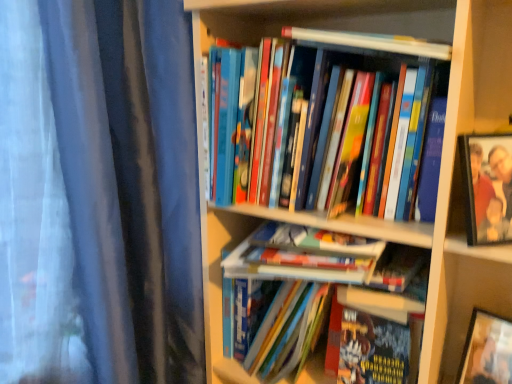
Question: Can you confirm if wooden bookshelf at center is bigger than hardcover books at center, the fourth book positioned from the top?

Choices:
 (A) yes
 (B) no

Answer: (A)

Question: From a real-world perspective, is wooden bookshelf at center on top of hardcover books at center, the fourth book positioned from the top?

Choices:
 (A) no
 (B) yes

Answer: (B)

Question: Would you say wooden bookshelf at center is outside hardcover books at center, the fourth book positioned from the top?

Choices:
 (A) yes
 (B) no

Answer: (A)

Question: Does wooden bookshelf at center have a lesser width compared to hardcover books at center, which ranks as the 3th book in bottom-to-top order?

Choices:
 (A) yes
 (B) no

Answer: (B)

Question: From the image's perspective, is wooden bookshelf at center on hardcover books at center, which ranks as the 3th book in bottom-to-top order?

Choices:
 (A) yes
 (B) no

Answer: (A)

Question: Is hardcover book at center, placed as the fifth book when sorted from top to bottom, wider or thinner than hardcover book at center, the 6th book from the top?

Choices:
 (A) wide
 (B) thin

Answer: (A)

Question: From a real-world perspective, is hardcover book at center, placed as the fifth book when sorted from top to bottom, positioned above or below hardcover book at center, the 1th book in the bottom-to-top sequence?

Choices:
 (A) below
 (B) above

Answer: (B)

Question: From the image's perspective, is hardcover book at center, which is the 2th book in bottom-to-top order, above or below hardcover book at center, the 1th book in the bottom-to-top sequence?

Choices:
 (A) below
 (B) above

Answer: (B)

Question: Would you say hardcover book at center, which is the 2th book in bottom-to-top order, is inside or outside hardcover book at center, the 6th book from the top?

Choices:
 (A) inside
 (B) outside

Answer: (B)

Question: Choose the correct answer: Is hardcover books at center, the fourth book positioned from the top, inside wooden bookshelf at center or outside it?

Choices:
 (A) inside
 (B) outside

Answer: (A)

Question: From their relative heights in the image, would you say hardcover books at center, the fourth book positioned from the top, is taller or shorter than wooden bookshelf at center?

Choices:
 (A) tall
 (B) short

Answer: (B)

Question: In the image, is hardcover books at center, which ranks as the 3th book in bottom-to-top order, on the left side or the right side of wooden bookshelf at center?

Choices:
 (A) left
 (B) right

Answer: (B)

Question: Is hardcover books at center, the fourth book positioned from the top, bigger or smaller than wooden bookshelf at center?

Choices:
 (A) small
 (B) big

Answer: (A)

Question: Considering the positions of hardcover books at center, which is the 2th book in top-to-bottom order, and hardcover book at center, the 6th book from the top, in the image, is hardcover books at center, which is the 2th book in top-to-bottom order, taller or shorter than hardcover book at center, the 6th book from the top,?

Choices:
 (A) short
 (B) tall

Answer: (B)

Question: Considering their positions, is hardcover books at center, acting as the 5th book starting from the bottom, located in front of or behind hardcover book at center, the 1th book in the bottom-to-top sequence?

Choices:
 (A) front
 (B) behind

Answer: (A)